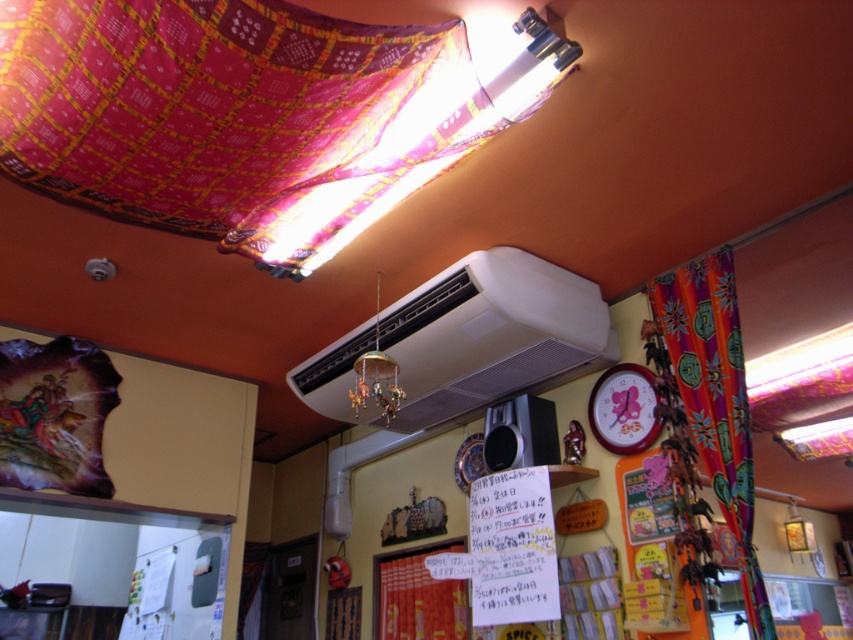
Question: Is white matte air conditioner at upper center to the left of red fabric tapestry at lower center from the viewer's perspective?

Choices:
 (A) yes
 (B) no

Answer: (B)

Question: Which point is closer to the camera taking this photo?

Choices:
 (A) (125, 212)
 (B) (604, 420)
 (C) (393, 589)
 (D) (701, 442)

Answer: (A)

Question: Does multicolored fabric curtain at right have a greater width compared to red fabric tapestry at lower center?

Choices:
 (A) no
 (B) yes

Answer: (A)

Question: Estimate the real-world distances between objects in this image. Which object is farther from the wooden clock at upper right?

Choices:
 (A) multicolored fabric curtain at right
 (B) multicolored woven cloth at upper center
 (C) red fabric tapestry at lower center
 (D) white matte air conditioner at upper center

Answer: (B)

Question: Is multicolored woven cloth at upper center to the left of red fabric tapestry at lower center from the viewer's perspective?

Choices:
 (A) no
 (B) yes

Answer: (B)

Question: Among these points, which one is nearest to the camera?

Choices:
 (A) (598, 380)
 (B) (410, 577)
 (C) (718, 388)
 (D) (494, 385)

Answer: (C)